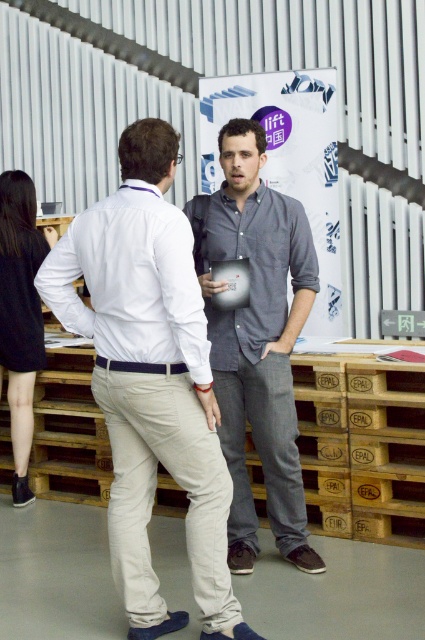
Question: Which of the following is the closest to the observer?

Choices:
 (A) (73, 250)
 (B) (275, 246)
 (C) (112, 403)
 (D) (289, 513)

Answer: (C)

Question: Which is farther from the white cotton shirt at center?

Choices:
 (A) dark gray cotton shirt at center
 (B) black dress at left
 (C) white matte shirt at center
 (D) gray cotton shirt at center

Answer: (B)

Question: Observing the image, what is the correct spatial positioning of white cotton shirt at center in reference to gray cotton shirt at center?

Choices:
 (A) below
 (B) above

Answer: (A)

Question: Is gray cotton shirt at center below dark gray cotton shirt at center?

Choices:
 (A) no
 (B) yes

Answer: (B)

Question: Which object is farther from the camera taking this photo?

Choices:
 (A) dark gray cotton shirt at center
 (B) white cotton shirt at center
 (C) gray cotton shirt at center
 (D) white matte shirt at center

Answer: (A)

Question: Is white matte shirt at center wider than dark gray cotton shirt at center?

Choices:
 (A) no
 (B) yes

Answer: (B)